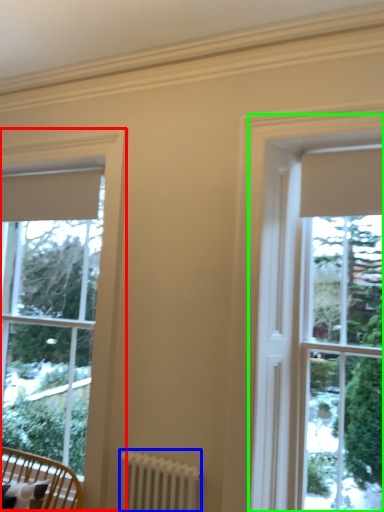
Question: Based on their relative distances, which object is nearer to window (highlighted by a red box)? Choose from radiator (highlighted by a blue box) and bay window (highlighted by a green box).

Choices:
 (A) radiator
 (B) bay window

Answer: (A)